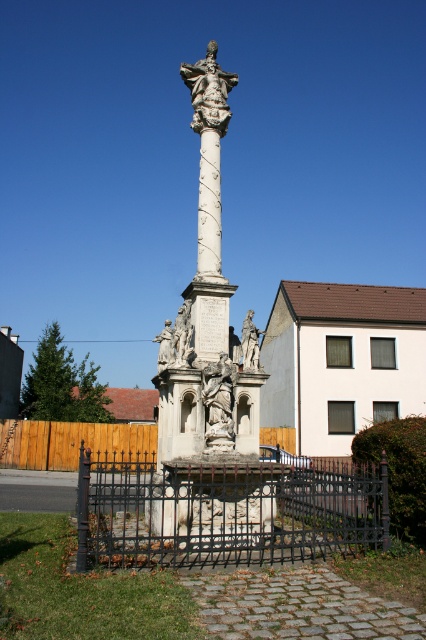
Does black wrought iron fence at center have a smaller size compared to wooden fence at lower left?

Incorrect, black wrought iron fence at center is not smaller in size than wooden fence at lower left.

Which of these two, black wrought iron fence at center or wooden fence at lower left, stands shorter?

wooden fence at lower left

The width and height of the screenshot is (426, 640). Identify the location of black wrought iron fence at center. (224, 512).

Between point (204, 220) and point (54, 444), which one is positioned behind?

The point (54, 444) is behind.

Is point (206, 104) positioned before point (146, 458)?

Yes, it is in front of point (146, 458).

Measure the distance between point (218,212) and camera.

51.05 feet

Locate an element on the screen. white stone column at center is located at coordinates (209, 372).

Can you confirm if wooden fence at lower left is positioned below white stone statue at center?

Yes.

Who is positioned more to the right, wooden fence at lower left or white stone statue at center?

From the viewer's perspective, white stone statue at center appears more on the right side.

Who is more forward, (149, 448) or (253, 358)?

Point (253, 358) is more forward.

I want to click on wooden fence at lower left, so tap(71, 442).